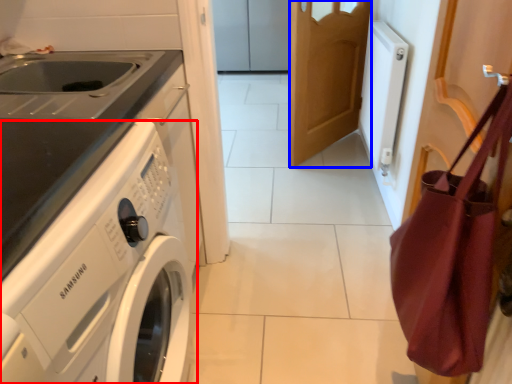
Question: Which of the following is the farthest to the observer, washing machine (highlighted by a red box) or door (highlighted by a blue box)?

Choices:
 (A) washing machine
 (B) door

Answer: (B)